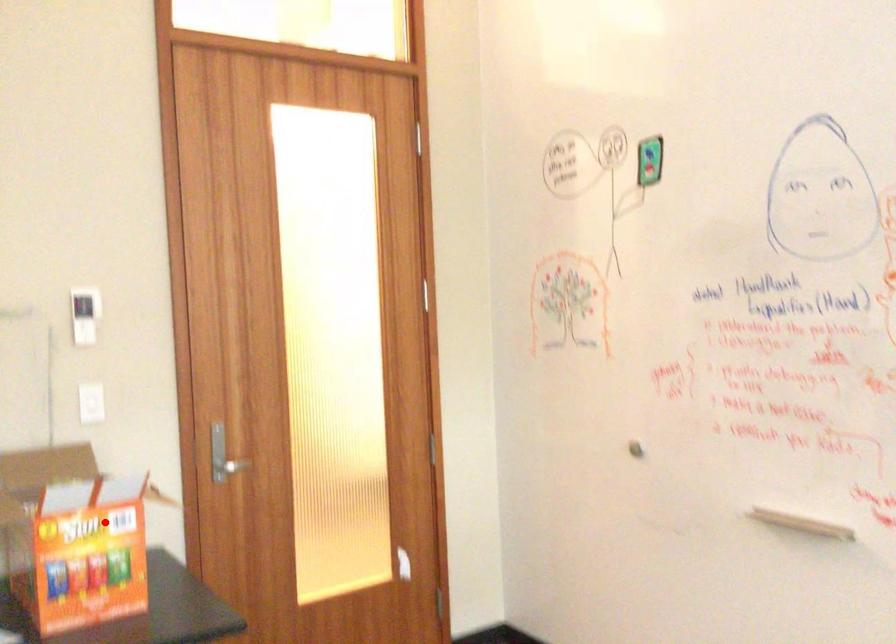
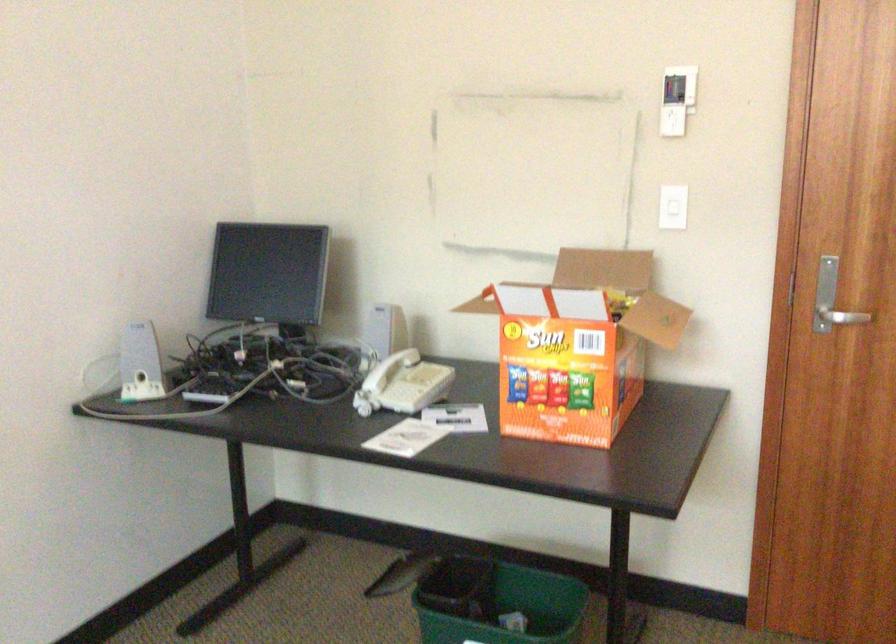
Question: I am providing you with two images of the same scene from different viewpoints. Image1 has a red point marked. In image2, the corresponding 3D location appears at what relative position? Reply with the corresponding letter.

Choices:
 (A) Closer
 (B) Farther

Answer: (A)